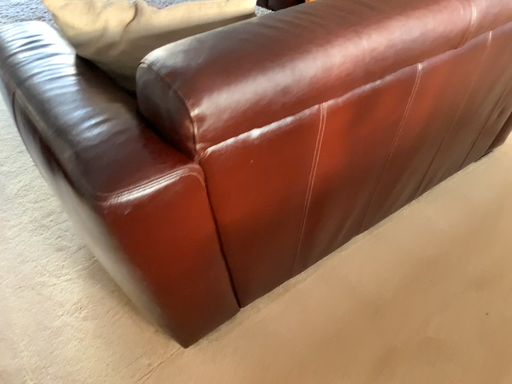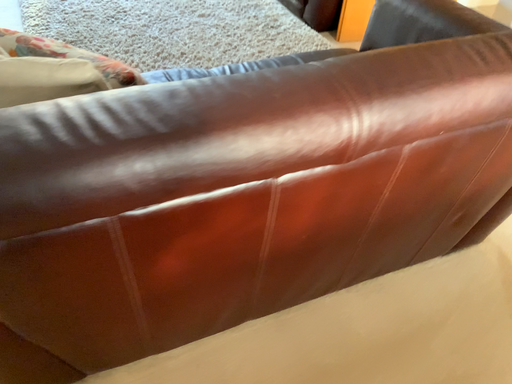
Question: Which way did the camera rotate in the video?

Choices:
 (A) rotated right
 (B) rotated left

Answer: (B)